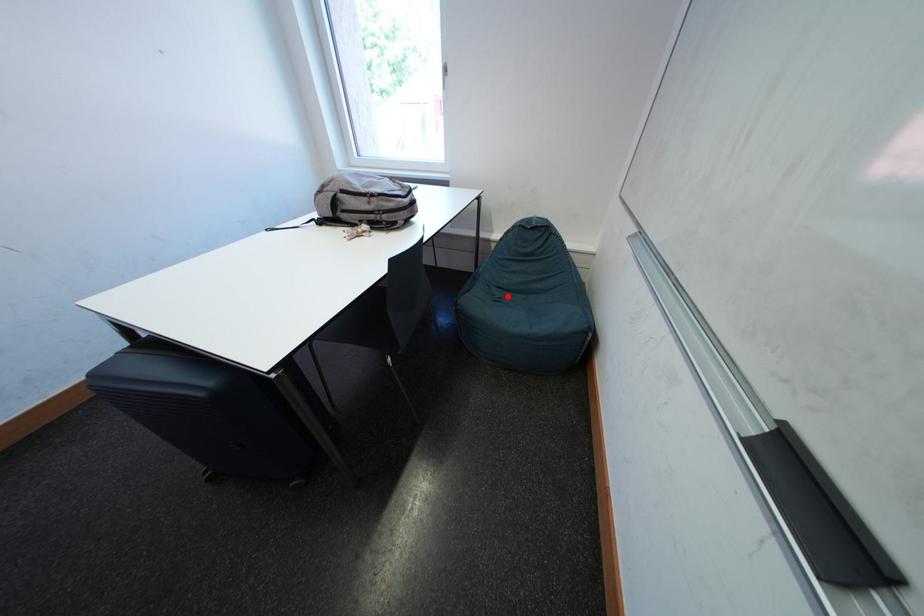
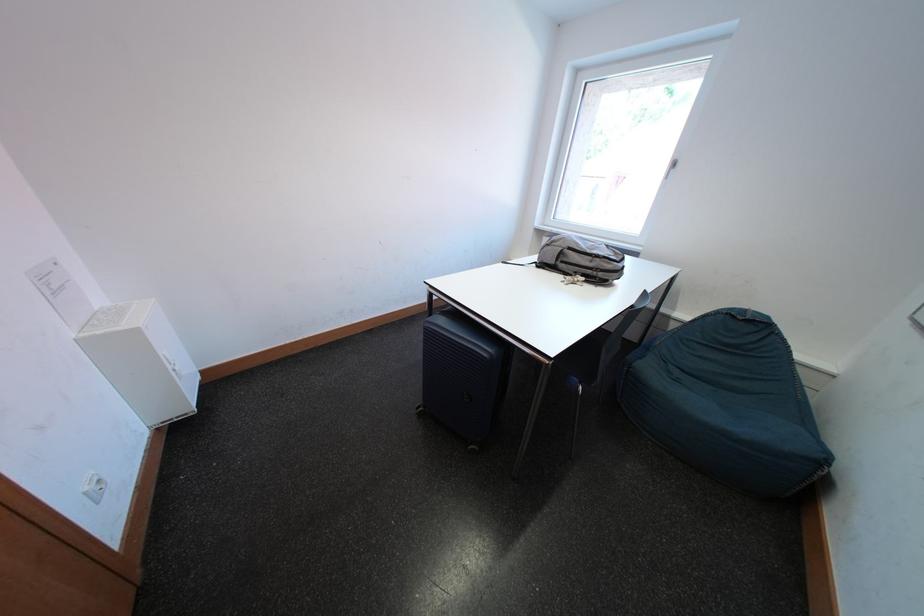
In the second image, find the point that corresponds to the highlighted location in the first image.

(687, 376)